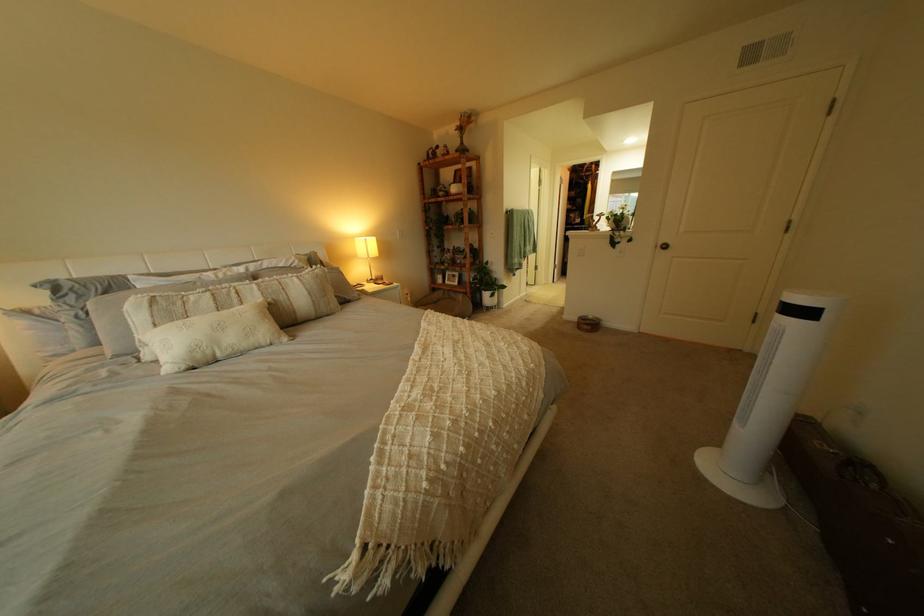
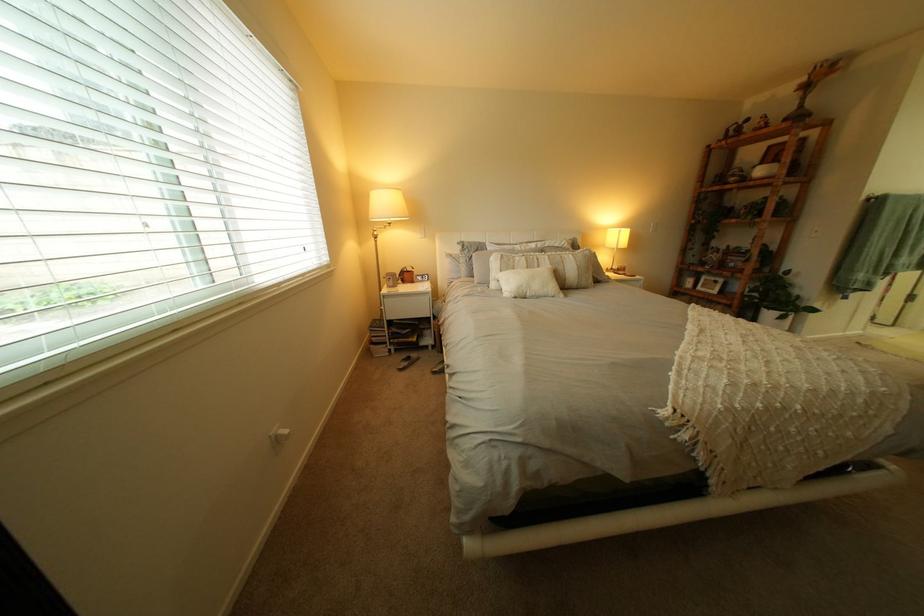
Question: The images are taken continuously from a first-person perspective. In which direction is your viewpoint rotating?

Choices:
 (A) Left
 (B) Right
 (C) Up
 (D) Down

Answer: (A)